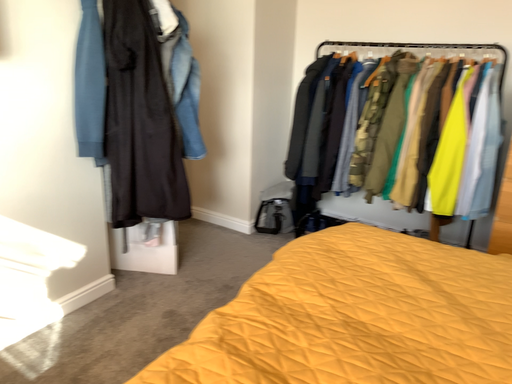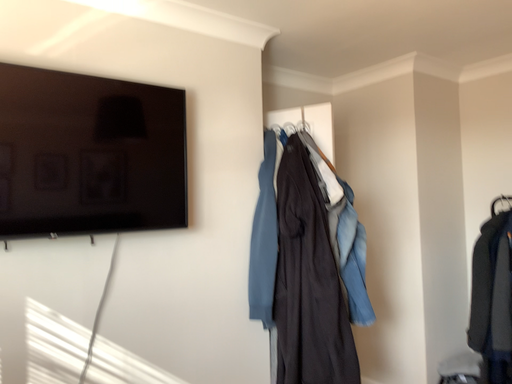
Question: Which way did the camera rotate in the video?

Choices:
 (A) rotated left
 (B) rotated right

Answer: (A)